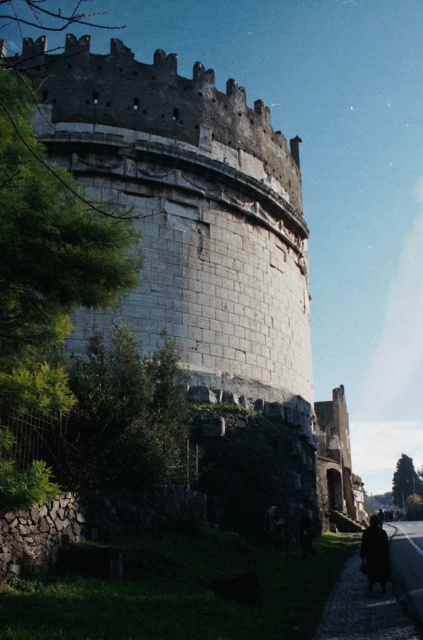
Which is more to the right, white stone fort at center or dark wool coat at lower right?

Positioned to the right is dark wool coat at lower right.

Which is in front, point (247, 236) or point (365, 531)?

Point (365, 531) is in front.

What are the coordinates of `white stone fort at center` in the screenshot? It's located at (200, 221).